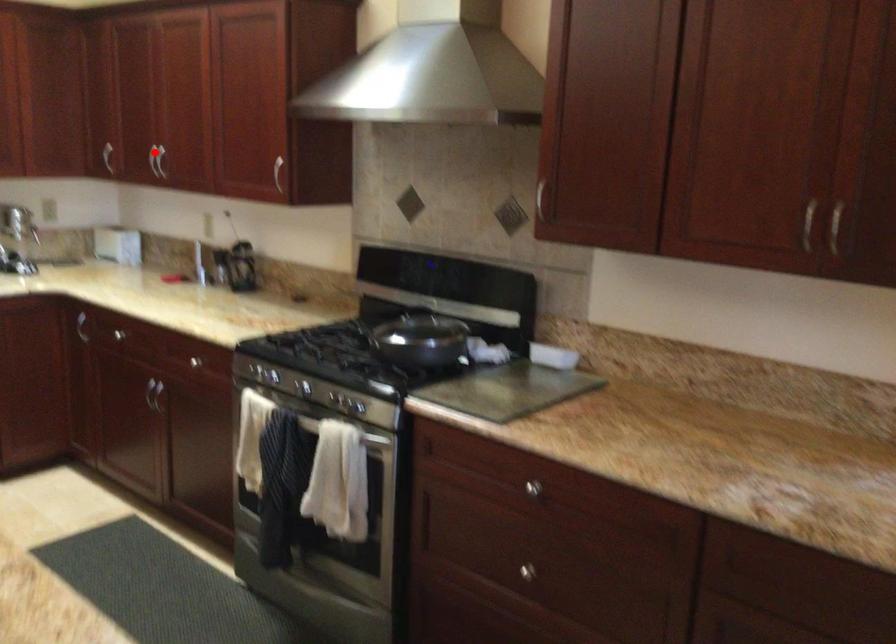
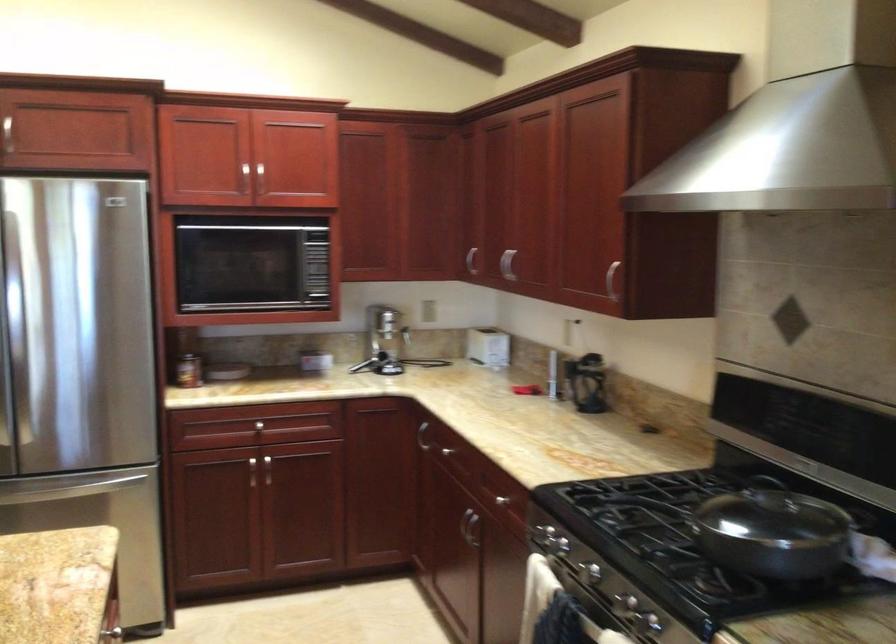
Find the pixel in the second image that matches the highlighted location in the first image.

(506, 263)